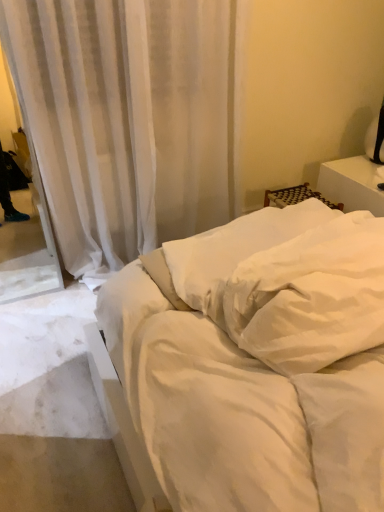
This screenshot has width=384, height=512. Describe the element at coordinates (130, 118) in the screenshot. I see `white sheer curtain at upper center` at that location.

What do you see at coordinates (259, 362) in the screenshot? The width and height of the screenshot is (384, 512). I see `white smooth bed at center` at bounding box center [259, 362].

Where is `white smooth bed at center`? The width and height of the screenshot is (384, 512). white smooth bed at center is located at coordinates (259, 362).

What is the approximate height of white soft pillow at center, the first pillow positioned from the back?

It is 11.41 inches.

What do you see at coordinates (311, 296) in the screenshot? The image size is (384, 512). I see `white soft pillow at center, placed as the first pillow when sorted from front to back` at bounding box center [311, 296].

The width and height of the screenshot is (384, 512). In order to click on white sheer curtain at upper center in this screenshot , I will do `click(130, 118)`.

Is white soft pillow at center, placed as the first pillow when sorted from front to back, at the right side of white soft pillow at center, the first pillow positioned from the back?

Yes.

Can you confirm if white soft pillow at center, placed as the first pillow when sorted from front to back, is thinner than white soft pillow at center, the second pillow in the front-to-back sequence?

Yes.

Considering the relative sizes of white soft pillow at center, placed as the second pillow when sorted from back to front, and white soft pillow at center, the second pillow in the front-to-back sequence, in the image provided, is white soft pillow at center, placed as the second pillow when sorted from back to front, bigger than white soft pillow at center, the second pillow in the front-to-back sequence,?

No, white soft pillow at center, placed as the second pillow when sorted from back to front, is not bigger than white soft pillow at center, the second pillow in the front-to-back sequence.

Looking at this image, from a real-world perspective, relative to white soft pillow at center, the first pillow positioned from the back, is white soft pillow at center, placed as the first pillow when sorted from front to back, vertically above or below?

From a real-world perspective, white soft pillow at center, placed as the first pillow when sorted from front to back, is physically above white soft pillow at center, the first pillow positioned from the back.

In the scene shown: From their relative heights in the image, would you say white smooth bed at center is taller or shorter than white sheer curtain at upper center?

Clearly, white smooth bed at center is shorter compared to white sheer curtain at upper center.

Can you confirm if white smooth bed at center is wider than white sheer curtain at upper center?

Correct, the width of white smooth bed at center exceeds that of white sheer curtain at upper center.

You are a GUI agent. You are given a task and a screenshot of the screen. Output one action in this format:
    pyautogui.click(x=<x>, y=<y>)
    Task: Click on the curtain above the white smooth bed at center (from a real-world perspective)
    
    Given the screenshot: What is the action you would take?
    pyautogui.click(x=130, y=118)

Is white smooth bed at center positioned in front of white sheer curtain at upper center?

Yes, white smooth bed at center is closer to the viewer.

Is white soft pillow at center, the second pillow in the front-to-back sequence, with white smooth bed at center?

white soft pillow at center, the second pillow in the front-to-back sequence, and white smooth bed at center are clearly separated.

Is white soft pillow at center, the first pillow positioned from the back, positioned beyond the bounds of white smooth bed at center?

No, white soft pillow at center, the first pillow positioned from the back, is inside or overlapping with white smooth bed at center.

In terms of size, does white soft pillow at center, the second pillow in the front-to-back sequence, appear bigger or smaller than white smooth bed at center?

In the image, white soft pillow at center, the second pillow in the front-to-back sequence, appears to be smaller than white smooth bed at center.

From the image's perspective, which pillow is the 2nd one above the white smooth bed at center? Please provide its 2D coordinates.

[(234, 251)]

Does white soft pillow at center, the second pillow in the front-to-back sequence, lie behind white sheer curtain at upper center?

No, it is in front of white sheer curtain at upper center.

From the image's perspective, is white soft pillow at center, the first pillow positioned from the back, below white sheer curtain at upper center?

Yes, from the image's perspective, white soft pillow at center, the first pillow positioned from the back, is beneath white sheer curtain at upper center.

Is white sheer curtain at upper center a part of white soft pillow at center, the second pillow in the front-to-back sequence?

No, white soft pillow at center, the second pillow in the front-to-back sequence, does not contain white sheer curtain at upper center.

Could you tell me if white soft pillow at center, the second pillow in the front-to-back sequence, is facing white sheer curtain at upper center?

No.

Between white soft pillow at center, placed as the second pillow when sorted from back to front, and white sheer curtain at upper center, which one has larger size?

white sheer curtain at upper center is bigger.

How different are the orientations of white soft pillow at center, placed as the second pillow when sorted from back to front, and white sheer curtain at upper center in degrees?

They differ by 2.9 degrees in their facing directions.

Could you tell me if white soft pillow at center, placed as the second pillow when sorted from back to front, is facing white sheer curtain at upper center?

No, white soft pillow at center, placed as the second pillow when sorted from back to front, is not facing towards white sheer curtain at upper center.

Identify the location of the 2nd pillow below when counting from the white sheer curtain at upper center (from the image's perspective). (311, 296).

Between white smooth bed at center and white soft pillow at center, placed as the first pillow when sorted from front to back, which one has larger size?

white smooth bed at center.

From a real-world perspective, does white smooth bed at center stand above white soft pillow at center, placed as the first pillow when sorted from front to back?

Incorrect, from a real-world perspective, white smooth bed at center is lower than white soft pillow at center, placed as the first pillow when sorted from front to back.

Considering the positions of point (218, 509) and point (374, 301), is point (218, 509) closer or farther from the camera than point (374, 301)?

Point (218, 509) appears to be closer to the viewer than point (374, 301).

Is white smooth bed at center to the left or to the right of white soft pillow at center, placed as the first pillow when sorted from front to back, in the image?

Based on their positions, white smooth bed at center is located to the left of white soft pillow at center, placed as the first pillow when sorted from front to back.

From the image's perspective, is white soft pillow at center, placed as the first pillow when sorted from front to back, on white smooth bed at center?

Yes, from the image's perspective, white soft pillow at center, placed as the first pillow when sorted from front to back, is above white smooth bed at center.

In the scene shown: Is white soft pillow at center, placed as the second pillow when sorted from back to front, positioned behind white smooth bed at center?

Yes, the depth of white soft pillow at center, placed as the second pillow when sorted from back to front, is greater than that of white smooth bed at center.

At what (x,y) coordinates should I click in order to perform the action: click on bed below the white soft pillow at center, placed as the first pillow when sorted from front to back (from the image's perspective). Please return your answer as a coordinate pair (x, y). Looking at the image, I should click on [259, 362].

Looking at the image, does white soft pillow at center, placed as the second pillow when sorted from back to front, seem bigger or smaller compared to white smooth bed at center?

Clearly, white soft pillow at center, placed as the second pillow when sorted from back to front, is smaller in size than white smooth bed at center.

This screenshot has height=512, width=384. In order to click on pillow lying on the left of white soft pillow at center, placed as the second pillow when sorted from back to front in this screenshot , I will do `click(234, 251)`.

The image size is (384, 512). Identify the location of curtain above the white smooth bed at center (from the image's perspective). (130, 118).

Looking at the image, which one is located further to white soft pillow at center, the second pillow in the front-to-back sequence, white soft pillow at center, placed as the second pillow when sorted from back to front, or white smooth bed at center?

white soft pillow at center, placed as the second pillow when sorted from back to front, is positioned further to the anchor white soft pillow at center, the second pillow in the front-to-back sequence.

When comparing their distances from white soft pillow at center, placed as the second pillow when sorted from back to front, does white soft pillow at center, the second pillow in the front-to-back sequence, or white sheer curtain at upper center seem further?

Among the two, white sheer curtain at upper center is located further to white soft pillow at center, placed as the second pillow when sorted from back to front.

Considering their positions, is white soft pillow at center, placed as the first pillow when sorted from front to back, positioned closer to white smooth bed at center than white soft pillow at center, the first pillow positioned from the back?

white soft pillow at center, placed as the first pillow when sorted from front to back.

Considering their positions, is white soft pillow at center, the second pillow in the front-to-back sequence, positioned closer to white sheer curtain at upper center than white smooth bed at center?

The object closer to white sheer curtain at upper center is white soft pillow at center, the second pillow in the front-to-back sequence.

Estimate the real-world distances between objects in this image. Which object is further from white smooth bed at center, white soft pillow at center, placed as the second pillow when sorted from back to front, or white sheer curtain at upper center?

white sheer curtain at upper center is further to white smooth bed at center.

Consider the image. When comparing their distances from white soft pillow at center, the second pillow in the front-to-back sequence, does white sheer curtain at upper center or white smooth bed at center seem closer?

white smooth bed at center lies closer to white soft pillow at center, the second pillow in the front-to-back sequence, than the other object.

Estimate the real-world distances between objects in this image. Which object is closer to white soft pillow at center, placed as the second pillow when sorted from back to front, white sheer curtain at upper center or white soft pillow at center, the first pillow positioned from the back?

white soft pillow at center, the first pillow positioned from the back.

When comparing their distances from white soft pillow at center, the second pillow in the front-to-back sequence, does white soft pillow at center, placed as the first pillow when sorted from front to back, or white sheer curtain at upper center seem further?

The object further to white soft pillow at center, the second pillow in the front-to-back sequence, is white sheer curtain at upper center.

I want to click on pillow positioned between white smooth bed at center and white soft pillow at center, the second pillow in the front-to-back sequence, from near to far, so click(311, 296).

The height and width of the screenshot is (512, 384). I want to click on pillow that lies between white sheer curtain at upper center and white soft pillow at center, placed as the first pillow when sorted from front to back, from top to bottom, so click(x=234, y=251).